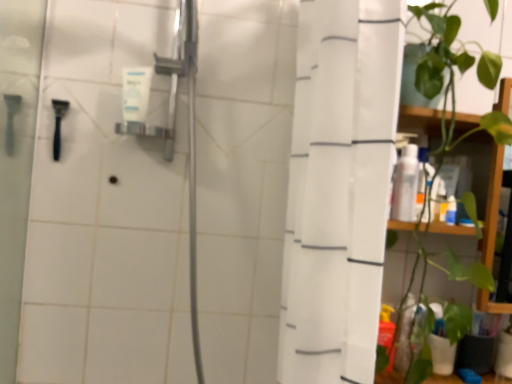
Question: Does white matte tube at upper center, the 2th toiletry positioned from the bottom, appear on the right side of white glossy bottle at right, the 2th toiletry viewed from the left?

Choices:
 (A) yes
 (B) no

Answer: (B)

Question: Is white matte tube at upper center, marked as the first toiletry in a left-to-right arrangement, not close to white glossy bottle at right, which appears as the 1th toiletry when viewed from the right?

Choices:
 (A) yes
 (B) no

Answer: (B)

Question: Considering the relative sizes of white matte tube at upper center, marked as the first toiletry in a left-to-right arrangement, and white glossy bottle at right, which appears as the 1th toiletry when viewed from the right, in the image provided, is white matte tube at upper center, marked as the first toiletry in a left-to-right arrangement, smaller than white glossy bottle at right, which appears as the 1th toiletry when viewed from the right,?

Choices:
 (A) no
 (B) yes

Answer: (A)

Question: Can you confirm if white matte tube at upper center, the 2th toiletry positioned from the bottom, is thinner than white glossy bottle at right, which appears as the 1th toiletry when viewed from the right?

Choices:
 (A) no
 (B) yes

Answer: (B)

Question: Would you say white matte tube at upper center, acting as the second toiletry starting from the right, is outside white glossy bottle at right, which appears as the 1th toiletry when viewed from the right?

Choices:
 (A) yes
 (B) no

Answer: (A)

Question: From a real-world perspective, is black plastic razor at left positioned above or below white glossy bottle at right, the second toiletry when ordered from top to bottom?

Choices:
 (A) above
 (B) below

Answer: (A)

Question: Relative to white glossy bottle at right, marked as the first toiletry in a bottom-to-top arrangement, is black plastic razor at left in front or behind?

Choices:
 (A) front
 (B) behind

Answer: (B)

Question: Is black plastic razor at left taller or shorter than white glossy bottle at right, which appears as the 1th toiletry when viewed from the right?

Choices:
 (A) tall
 (B) short

Answer: (B)

Question: In terms of width, does black plastic razor at left look wider or thinner when compared to white glossy bottle at right, marked as the first toiletry in a bottom-to-top arrangement?

Choices:
 (A) thin
 (B) wide

Answer: (A)

Question: From the image's perspective, relative to green leafy plant at right, is white fabric shower curtain at right above or below?

Choices:
 (A) above
 (B) below

Answer: (B)

Question: Is white fabric shower curtain at right inside or outside of green leafy plant at right?

Choices:
 (A) outside
 (B) inside

Answer: (A)

Question: Relative to green leafy plant at right, is white fabric shower curtain at right in front or behind?

Choices:
 (A) front
 (B) behind

Answer: (A)

Question: From a real-world perspective, is white fabric shower curtain at right positioned above or below green leafy plant at right?

Choices:
 (A) below
 (B) above

Answer: (A)

Question: Considering the positions of point (463, 127) and point (121, 100), is point (463, 127) closer or farther from the camera than point (121, 100)?

Choices:
 (A) farther
 (B) closer

Answer: (B)

Question: In terms of width, does green leafy plant at right look wider or thinner when compared to white matte tube at upper center, the 2th toiletry positioned from the bottom?

Choices:
 (A) thin
 (B) wide

Answer: (B)